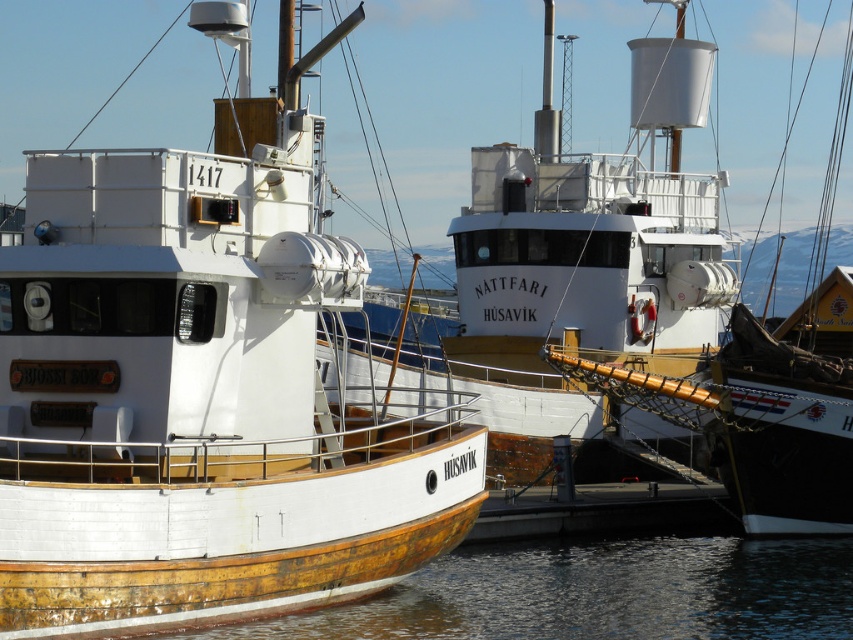
Is point (515, 550) in front of point (784, 358)?

No, it is not.

Is point (514, 547) positioned in front of point (833, 476)?

No, it is not.

Identify the location of wooden water at lower left. (601, 593).

Is wooden hull boat at center taller than white matte boat at center?

Incorrect, wooden hull boat at center's height is not larger of white matte boat at center's.

Does wooden hull boat at center have a smaller size compared to white matte boat at center?

Yes.

In order to click on wooden hull boat at center in this screenshot , I will do `click(198, 397)`.

Is wooden hull boat at center taller than wooden ship at center?

Incorrect, wooden hull boat at center's height is not larger of wooden ship at center's.

Does wooden hull boat at center have a greater width compared to wooden ship at center?

In fact, wooden hull boat at center might be narrower than wooden ship at center.

Is point (65, 440) positioned after point (840, 128)?

No.

Locate an element on the screen. The image size is (853, 640). wooden hull boat at center is located at coordinates (198, 397).